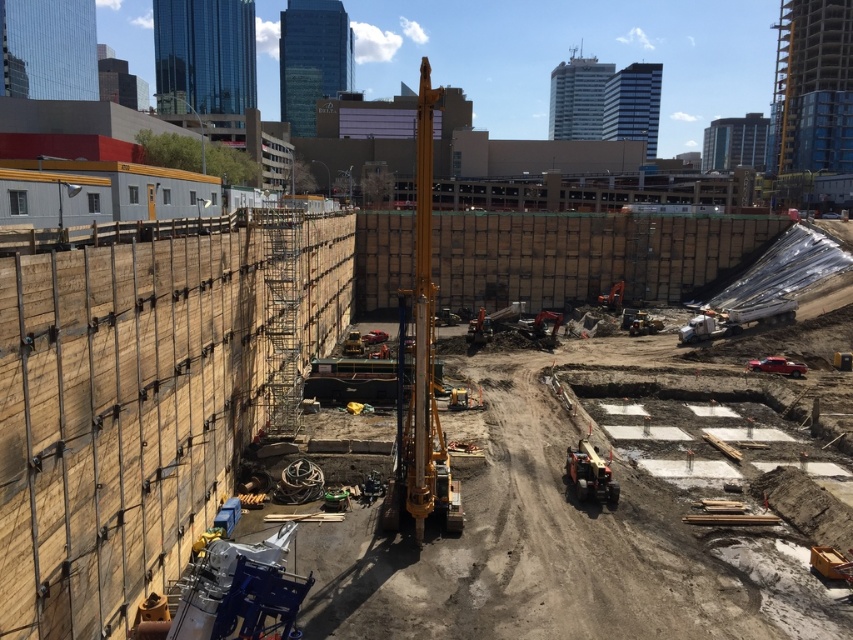
Question: Which of the following is the closest to the observer?

Choices:
 (A) yellow metallic drilling rig at center
 (B) metallic yellow crane at center

Answer: (A)

Question: Can you confirm if yellow metallic drilling rig at center is positioned above metallic yellow crane at center?

Choices:
 (A) no
 (B) yes

Answer: (B)

Question: Which point appears farthest from the camera in this image?

Choices:
 (A) (581, 460)
 (B) (421, 188)

Answer: (A)

Question: Does yellow metallic drilling rig at center have a greater width compared to metallic yellow crane at center?

Choices:
 (A) no
 (B) yes

Answer: (B)

Question: Is yellow metallic drilling rig at center bigger than metallic yellow crane at center?

Choices:
 (A) yes
 (B) no

Answer: (A)